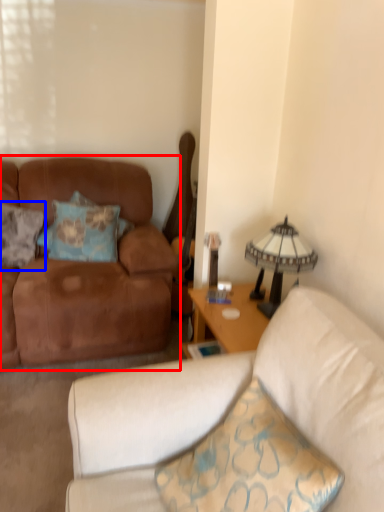
Question: Which object appears farthest to the camera in this image, studio couch (highlighted by a red box) or pillow (highlighted by a blue box)?

Choices:
 (A) studio couch
 (B) pillow

Answer: (B)